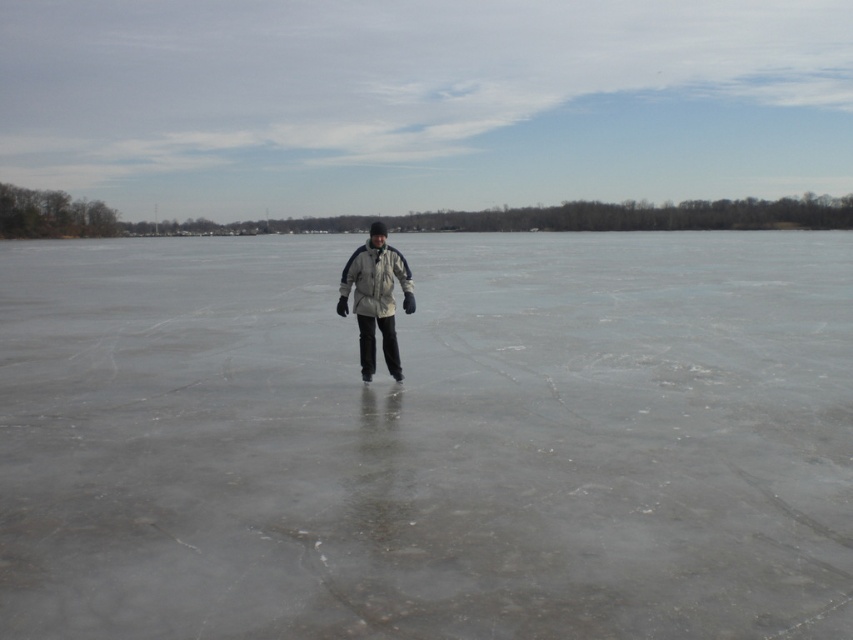
You are a safety inspector evaluating the ice conditions. You notice the transparent ice at center and the white matte jacket at center. Based on standard safety guidelines, which state that a safe distance between a person and thin ice is at least 20 feet, is the current separation between them compliant?

The distance between the transparent ice at center and the white matte jacket at center is 18.03 feet, which is less than the required 20 feet. Therefore, the current separation does not comply with safety guidelines.

You are a safety inspector assessing the frozen lake scene. The transparent ice at center and white matte jacket at center are visible. Based on their sizes, which object would you prioritize checking for safety concerns, and why?

The transparent ice at center is larger in size than the white matte jacket at center. Since the ice covers a greater area, it poses a higher risk if it is not solid, so the transparent ice at center should be prioritized for safety checks.